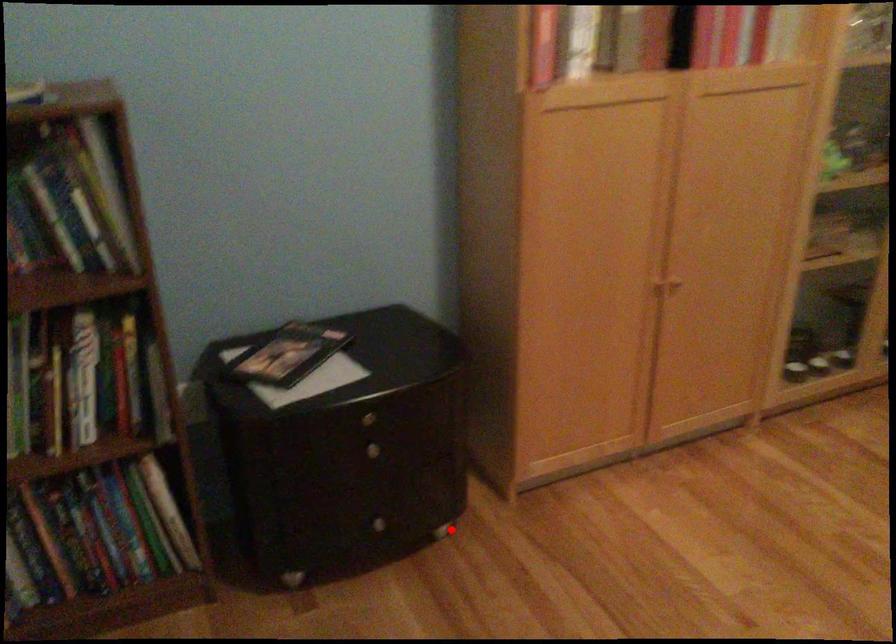
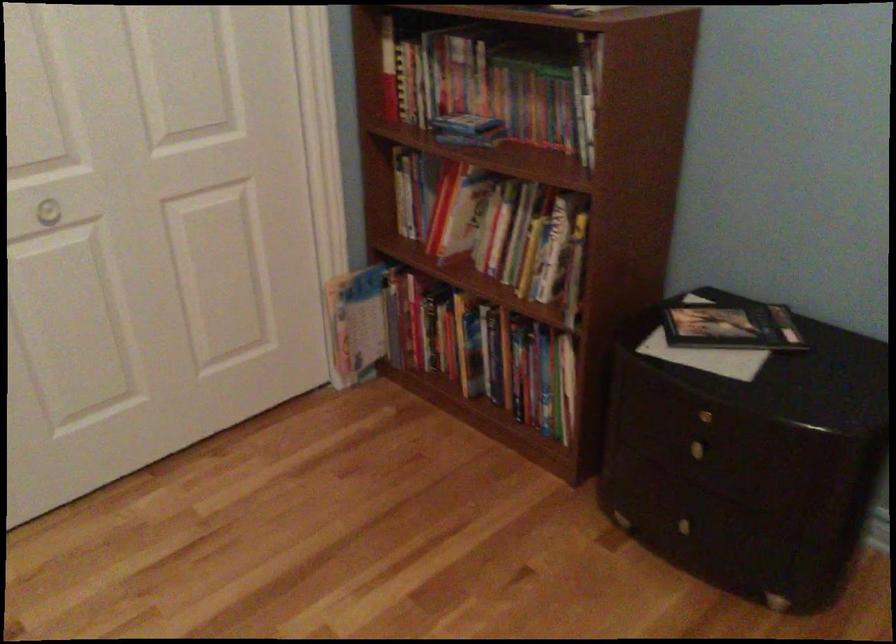
Find the pixel in the second image that matches the highlighted location in the first image.

(780, 603)